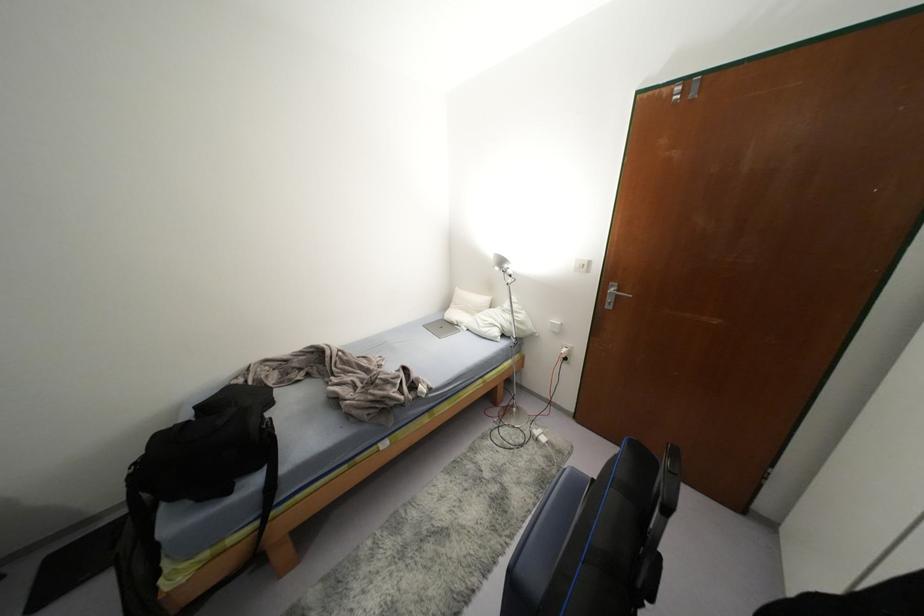
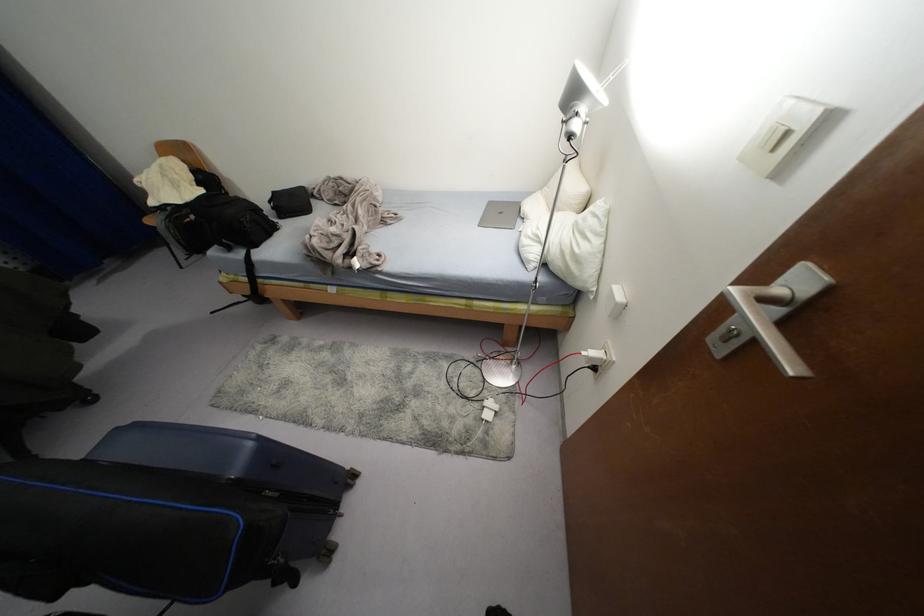
Where in the second image is the point corresponding to pixel 488 302 from the first image?

(579, 201)